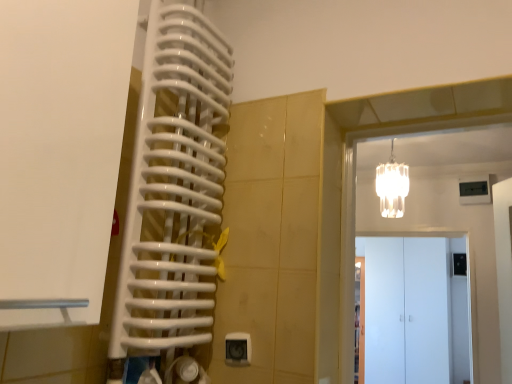
Question: Can you confirm if white glass chandelier at upper right is taller than white matte cabinet at center, the 2th door viewed from the back?

Choices:
 (A) yes
 (B) no

Answer: (B)

Question: Is white glass chandelier at upper right positioned with its back to white matte cabinet at center, the 2th door viewed from the back?

Choices:
 (A) yes
 (B) no

Answer: (B)

Question: Is white glass chandelier at upper right with white matte cabinet at center, the 2th door viewed from the front?

Choices:
 (A) no
 (B) yes

Answer: (A)

Question: Is white glass chandelier at upper right closer to the viewer compared to white matte cabinet at center, the 2th door viewed from the back?

Choices:
 (A) yes
 (B) no

Answer: (A)

Question: Is white glass chandelier at upper right further to the viewer compared to white matte cabinet at center, the 2th door when ordered from left to right?

Choices:
 (A) yes
 (B) no

Answer: (B)

Question: Is white glass chandelier at upper right thinner than white matte cabinet at center, the 2th door viewed from the back?

Choices:
 (A) no
 (B) yes

Answer: (A)

Question: From a real-world perspective, is white matte door at left, which appears as the third door when viewed from the back, physically below white glossy door at right, the third door from the front?

Choices:
 (A) no
 (B) yes

Answer: (A)

Question: Considering the relative sizes of white matte door at left, the 3th door viewed from the right, and white glossy door at right, which appears as the 1th door when viewed from the right, in the image provided, is white matte door at left, the 3th door viewed from the right, shorter than white glossy door at right, which appears as the 1th door when viewed from the right,?

Choices:
 (A) yes
 (B) no

Answer: (A)

Question: Could you tell me if white matte door at left, placed as the 1th door when sorted from left to right, is facing white glossy door at right, the third door from the front?

Choices:
 (A) no
 (B) yes

Answer: (A)

Question: From the image's perspective, is white matte door at left, which appears as the third door when viewed from the back, on white glossy door at right, the first door from the back?

Choices:
 (A) no
 (B) yes

Answer: (B)

Question: Considering the relative sizes of white matte door at left, which appears as the third door when viewed from the back, and white glossy door at right, the third door from the front, in the image provided, is white matte door at left, which appears as the third door when viewed from the back, smaller than white glossy door at right, the third door from the front,?

Choices:
 (A) yes
 (B) no

Answer: (A)

Question: Is white matte door at left, arranged as the 3th door when ordered from the bottom, to the right of white glossy door at right, which is counted as the first door, starting from the bottom, from the viewer's perspective?

Choices:
 (A) no
 (B) yes

Answer: (A)

Question: Is white matte door at left, marked as the first door in a top-to-bottom arrangement, thinner than white matte cabinet at center, the 2th door viewed from the back?

Choices:
 (A) no
 (B) yes

Answer: (A)